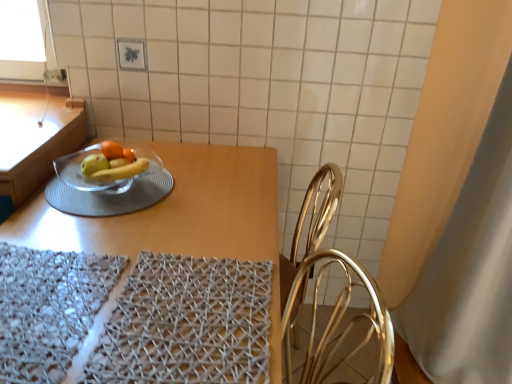
You are a GUI agent. You are given a task and a screenshot of the screen. Output one action in this format:
    pyautogui.click(x=<x>, y=<y>)
    Task: Click on the free space above woven fabric place mat at lower center, acting as the second place mat starting from the left (from a real-world perspective)
    This screenshot has width=512, height=384.
    Given the screenshot: What is the action you would take?
    pyautogui.click(x=175, y=328)